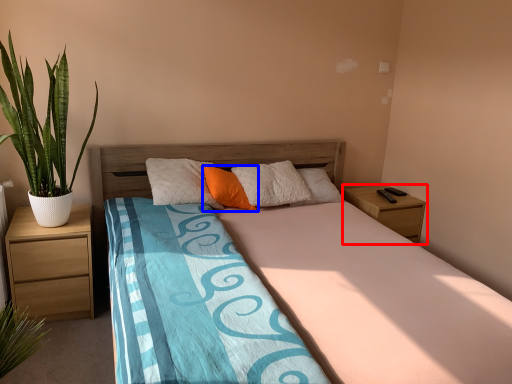
Question: Which point is further to the camera, nightstand (highlighted by a red box) or pillow (highlighted by a blue box)?

Choices:
 (A) nightstand
 (B) pillow

Answer: (A)